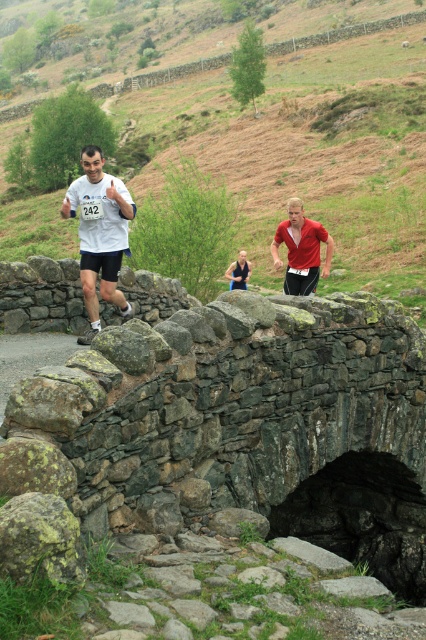
In the scene shown: How much distance is there between white matte shirt at center and red matte shirt at center?

white matte shirt at center and red matte shirt at center are 12.20 feet apart from each other.

Which is more to the right, white matte shirt at center or red matte shirt at center?

red matte shirt at center

Find the location of a particular element. Image resolution: width=426 pixels, height=640 pixels. white matte shirt at center is located at coordinates (100, 234).

Does white matte shirt at center appear under red fabric shirt at center?

Yes, white matte shirt at center is below red fabric shirt at center.

Which is in front, point (92, 180) or point (227, 269)?

Point (92, 180) is more forward.

Describe the element at coordinates (100, 234) in the screenshot. I see `white matte shirt at center` at that location.

In order to click on white matte shirt at center in this screenshot , I will do `click(100, 234)`.

Who is more forward, (157, 131) or (285, 282)?

→ Point (285, 282) is in front.

Find the location of a particular element. green grassy hillside at upper center is located at coordinates (304, 150).